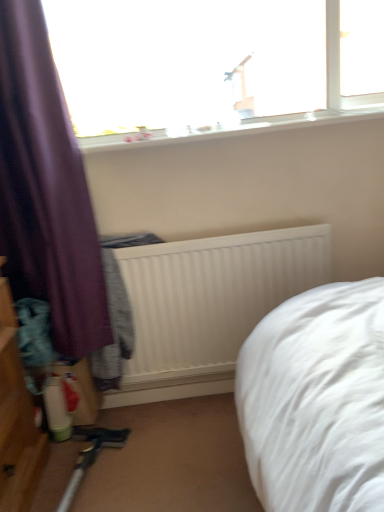
The height and width of the screenshot is (512, 384). Identify the location of white ribbed radiator at center. (212, 298).

Considering the relative sizes of purple fabric curtain at left and transparent glass window at upper center in the image provided, is purple fabric curtain at left taller than transparent glass window at upper center?

Indeed, purple fabric curtain at left has a greater height compared to transparent glass window at upper center.

Is purple fabric curtain at left positioned in front of transparent glass window at upper center?

Yes, purple fabric curtain at left is closer to the camera.

The width and height of the screenshot is (384, 512). I want to click on curtain beneath the transparent glass window at upper center (from a real-world perspective), so click(x=46, y=189).

Is transparent glass window at upper center not close to purple fabric curtain at left?

They are positioned close to each other.

Looking at the image, does transparent glass window at upper center seem bigger or smaller compared to purple fabric curtain at left?

Clearly, transparent glass window at upper center is smaller in size than purple fabric curtain at left.

From a real-world perspective, is transparent glass window at upper center on top of purple fabric curtain at left?

Yes, from a real-world perspective, transparent glass window at upper center is over purple fabric curtain at left

Relative to purple fabric curtain at left, is transparent glass window at upper center in front or behind?

Clearly, transparent glass window at upper center is behind purple fabric curtain at left.

From the image's perspective, which is below, purple fabric curtain at left or white ribbed radiator at center?

white ribbed radiator at center, from the image's perspective.

Locate an element on the screen. This screenshot has width=384, height=512. radiator below the purple fabric curtain at left (from a real-world perspective) is located at coordinates (212, 298).

Considering the sizes of objects purple fabric curtain at left and white ribbed radiator at center in the image provided, who is thinner, purple fabric curtain at left or white ribbed radiator at center?

white ribbed radiator at center is thinner.

Is purple fabric curtain at left oriented towards white ribbed radiator at center?

No, purple fabric curtain at left is not facing towards white ribbed radiator at center.

Can you confirm if white smooth window sill at upper center is taller than white ribbed radiator at center?

Incorrect, the height of white smooth window sill at upper center is not larger of that of white ribbed radiator at center.

Considering the positions of points (189, 139) and (238, 265), is point (189, 139) closer to camera compared to point (238, 265)?

Yes, point (189, 139) is in front of point (238, 265).

From the image's perspective, is white smooth window sill at upper center below white ribbed radiator at center?

Actually, white smooth window sill at upper center appears above white ribbed radiator at center in the image.

Is white smooth window sill at upper center facing towards white ribbed radiator at center?

No, white smooth window sill at upper center is not turned towards white ribbed radiator at center.

Can you tell me how much white smooth window sill at upper center and purple fabric curtain at left differ in facing direction?

2.92 degrees separate the facing orientations of white smooth window sill at upper center and purple fabric curtain at left.

Would you say white smooth window sill at upper center is inside or outside purple fabric curtain at left?

white smooth window sill at upper center is located beyond the bounds of purple fabric curtain at left.

Does point (347, 118) come behind point (24, 281)?

No, it is in front of (24, 281).

From the image's perspective, does white smooth window sill at upper center appear lower than purple fabric curtain at left?

No, from the image's perspective, white smooth window sill at upper center is not beneath purple fabric curtain at left.

Find the location of `window sill behind the transparent glass window at upper center`. window sill behind the transparent glass window at upper center is located at coordinates (227, 130).

Can you confirm if white smooth window sill at upper center is wider than transparent glass window at upper center?

Indeed, white smooth window sill at upper center has a greater width compared to transparent glass window at upper center.

Which of these two, white smooth window sill at upper center or transparent glass window at upper center, is smaller?

Smaller between the two is white smooth window sill at upper center.

Could you tell me if transparent glass window at upper center is facing white smooth window sill at upper center?

No, transparent glass window at upper center is not facing towards white smooth window sill at upper center.

Does transparent glass window at upper center have a greater width compared to white smooth window sill at upper center?

No.

Measure the distance from transparent glass window at upper center to white smooth window sill at upper center.

7.80 inches.

From a real-world perspective, is transparent glass window at upper center physically located above or below white smooth window sill at upper center?

In terms of real-world spatial position, transparent glass window at upper center is above white smooth window sill at upper center.

Find the location of a particular element. window that appears above the purple fabric curtain at left (from the image's perspective) is located at coordinates (214, 65).

This screenshot has height=512, width=384. I want to click on window that appears on the right of purple fabric curtain at left, so click(214, 65).

When comparing their distances from purple fabric curtain at left, does transparent glass window at upper center or white smooth window sill at upper center seem closer?

The object closer to purple fabric curtain at left is white smooth window sill at upper center.

Based on their spatial positions, is purple fabric curtain at left or white smooth window sill at upper center closer to transparent glass window at upper center?

white smooth window sill at upper center.

From the picture: Considering their positions, is white smooth window sill at upper center positioned closer to transparent glass window at upper center than white ribbed radiator at center?

white smooth window sill at upper center is positioned closer to the anchor transparent glass window at upper center.

Based on their spatial positions, is white ribbed radiator at center or white smooth window sill at upper center further from transparent glass window at upper center?

The object further to transparent glass window at upper center is white ribbed radiator at center.

Which object lies nearer to the anchor point white ribbed radiator at center, white smooth window sill at upper center or transparent glass window at upper center?

white smooth window sill at upper center is positioned closer to the anchor white ribbed radiator at center.

Estimate the real-world distances between objects in this image. Which object is closer to white smooth window sill at upper center, purple fabric curtain at left or white ribbed radiator at center?

purple fabric curtain at left is positioned closer to the anchor white smooth window sill at upper center.

Considering their positions, is white ribbed radiator at center positioned closer to transparent glass window at upper center than purple fabric curtain at left?

purple fabric curtain at left is closer to transparent glass window at upper center.

Looking at the image, which one is located closer to transparent glass window at upper center, purple fabric curtain at left or white ribbed radiator at center?

Among the two, purple fabric curtain at left is located nearer to transparent glass window at upper center.

Where is `radiator between purple fabric curtain at left and white smooth window sill at upper center in the horizontal direction`? This screenshot has width=384, height=512. radiator between purple fabric curtain at left and white smooth window sill at upper center in the horizontal direction is located at coordinates (212, 298).

Locate an element on the screen. The width and height of the screenshot is (384, 512). window located between purple fabric curtain at left and white smooth window sill at upper center in the left-right direction is located at coordinates point(214,65).

Locate an element on the screen. Image resolution: width=384 pixels, height=512 pixels. curtain that lies between transparent glass window at upper center and white ribbed radiator at center from top to bottom is located at coordinates (46, 189).

I want to click on window sill that lies between transparent glass window at upper center and white ribbed radiator at center from top to bottom, so click(227, 130).